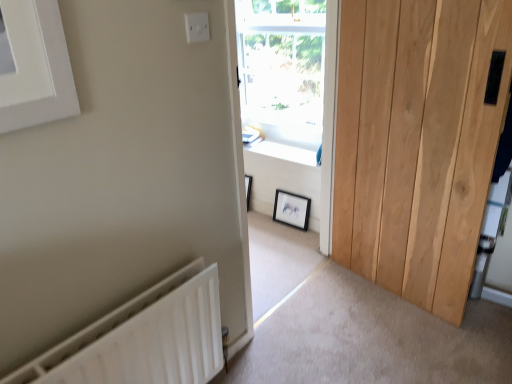
What do you see at coordinates (291, 209) in the screenshot? This screenshot has width=512, height=384. I see `black matte picture frame at center` at bounding box center [291, 209].

This screenshot has height=384, width=512. Identify the location of white matte radiator at lower left. (143, 338).

Measure the distance between point (148, 343) and camera.

4.33 feet.

This screenshot has width=512, height=384. Describe the element at coordinates (288, 99) in the screenshot. I see `white wood window frame at center` at that location.

Measure the distance between natural wood door at right and camera.

They are 4.64 feet apart.

Where is `black matte picture frame at center`? black matte picture frame at center is located at coordinates (291, 209).

Is transparent glass window at center not inside white matte radiator at lower left?

Yes, transparent glass window at center is not within white matte radiator at lower left.

Is transparent glass window at center oriented towards white matte radiator at lower left?

Yes, transparent glass window at center is facing white matte radiator at lower left.

How many degrees apart are the facing directions of transparent glass window at center and white matte radiator at lower left?

The angle between the facing direction of transparent glass window at center and the facing direction of white matte radiator at lower left is 91.1 degrees.

From the image's perspective, which object appears higher, transparent glass window at center or white matte radiator at lower left?

transparent glass window at center, from the image's perspective.

From a real-world perspective, is black matte picture frame at center positioned over transparent glass window at center based on gravity?

No, from a real-world perspective, black matte picture frame at center is not above transparent glass window at center.

Is black matte picture frame at center outside of transparent glass window at center?

black matte picture frame at center is positioned outside transparent glass window at center.

Is black matte picture frame at center at the left side of transparent glass window at center?

No.

Is black matte picture frame at center looking in the opposite direction of transparent glass window at center?

No, transparent glass window at center is not at the back of black matte picture frame at center.

Is white matte radiator at lower left thinner than white plastic electric outlet at upper center?

No.

Based on the photo, between white matte radiator at lower left and white plastic electric outlet at upper center, which one has more height?

white matte radiator at lower left is taller.

Based on their positions, is white matte radiator at lower left located to the left or right of white plastic electric outlet at upper center?

white matte radiator at lower left is positioned on white plastic electric outlet at upper center's left side.

Does white matte radiator at lower left touch white plastic electric outlet at upper center?

No, white matte radiator at lower left is not in contact with white plastic electric outlet at upper center.

I want to click on radiator below the natural wood door at right (from a real-world perspective), so [143, 338].

From a real-world perspective, which object stands above the other?

natural wood door at right.

Is the depth of natural wood door at right less than that of white matte radiator at lower left?

No, natural wood door at right is further to the viewer.

Does natural wood door at right touch white matte radiator at lower left?

No, natural wood door at right is not making contact with white matte radiator at lower left.

Considering the relative sizes of white plastic electric outlet at upper center and white smooth window sill at center in the image provided, is white plastic electric outlet at upper center bigger than white smooth window sill at center?

Actually, white plastic electric outlet at upper center might be smaller than white smooth window sill at center.

Considering the relative positions of white plastic electric outlet at upper center and white smooth window sill at center in the image provided, is white plastic electric outlet at upper center to the left or to the right of white smooth window sill at center?

white plastic electric outlet at upper center is to the left of white smooth window sill at center.

Is white plastic electric outlet at upper center thinner than white smooth window sill at center?

Correct, the width of white plastic electric outlet at upper center is less than that of white smooth window sill at center.

Identify the location of window sill that is below the white plastic electric outlet at upper center (from the image's perspective). The width and height of the screenshot is (512, 384). (286, 141).

Which object is further away from the camera, white matte radiator at lower left or black matte picture frame at center?

Positioned behind is black matte picture frame at center.

Is white matte radiator at lower left inside the boundaries of black matte picture frame at center, or outside?

white matte radiator at lower left is spatially situated outside black matte picture frame at center.

Considering the sizes of white matte radiator at lower left and black matte picture frame at center in the image, is white matte radiator at lower left wider or thinner than black matte picture frame at center?

Considering their sizes, white matte radiator at lower left looks broader than black matte picture frame at center.

How different are the orientations of white matte radiator at lower left and black matte picture frame at center in degrees?

There is a 89.7-degree angle between the facing directions of white matte radiator at lower left and black matte picture frame at center.

From a real-world perspective, is white smooth window sill at center below black matte picture frame at center?

No, from a real-world perspective, white smooth window sill at center is not beneath black matte picture frame at center.

Does white smooth window sill at center have a greater width compared to black matte picture frame at center?

Indeed, white smooth window sill at center has a greater width compared to black matte picture frame at center.

Does white smooth window sill at center have a lesser height compared to black matte picture frame at center?

Yes, white smooth window sill at center is shorter than black matte picture frame at center.

Can you confirm if white smooth window sill at center is positioned to the left of black matte picture frame at center?

Yes, white smooth window sill at center is to the left of black matte picture frame at center.

Find the location of a particular element. window above the white matte radiator at lower left (from the image's perspective) is located at coordinates (283, 70).

You are a GUI agent. You are given a task and a screenshot of the screen. Output one action in this format:
    pyautogui.click(x=<x>, y=<y>)
    Task: Click on the picture frame located below the transparent glass window at center (from the image's perspective)
    The height and width of the screenshot is (384, 512).
    Given the screenshot: What is the action you would take?
    coord(291,209)

Estimate the real-world distances between objects in this image. Which object is closer to transparent glass window at center, black matte picture frame at center or white matte radiator at lower left?

black matte picture frame at center.

Considering their positions, is black matte picture frame at center positioned further to white wood window frame at center than white smooth window sill at center?

black matte picture frame at center is further to white wood window frame at center.

Estimate the real-world distances between objects in this image. Which object is closer to white plastic electric outlet at upper center, transparent glass window at center or white smooth window sill at center?

white smooth window sill at center is positioned closer to the anchor white plastic electric outlet at upper center.

From the image, which object appears to be farther from white matte radiator at lower left, natural wood door at right or white smooth window sill at center?

white smooth window sill at center.

Estimate the real-world distances between objects in this image. Which object is closer to white matte radiator at lower left, transparent glass window at center or white wood window frame at center?

Based on the image, white wood window frame at center appears to be nearer to white matte radiator at lower left.

Estimate the real-world distances between objects in this image. Which object is further from natural wood door at right, transparent glass window at center or black matte picture frame at center?

Result: black matte picture frame at center lies further to natural wood door at right than the other object.

Looking at the image, which one is located further to white smooth window sill at center, transparent glass window at center or natural wood door at right?

natural wood door at right is positioned further to the anchor white smooth window sill at center.

Based on their spatial positions, is white plastic electric outlet at upper center or black matte picture frame at center closer to white wood window frame at center?

black matte picture frame at center is positioned closer to the anchor white wood window frame at center.

Where is `door located between white matte radiator at lower left and transparent glass window at center in the depth direction`? door located between white matte radiator at lower left and transparent glass window at center in the depth direction is located at coordinates (418, 141).

The width and height of the screenshot is (512, 384). Identify the location of window between white wood window frame at center and black matte picture frame at center in the front-back direction. (283, 70).

I want to click on window sill positioned between natural wood door at right and black matte picture frame at center from near to far, so tap(286, 141).

This screenshot has height=384, width=512. Identify the location of door between white plastic electric outlet at upper center and transparent glass window at center along the z-axis. (418, 141).